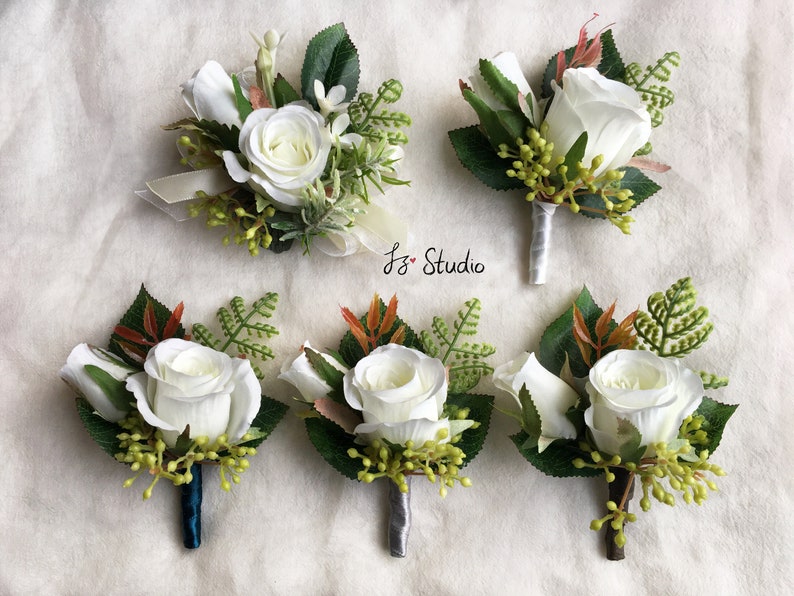
The height and width of the screenshot is (596, 794). I want to click on studio, so click(x=441, y=265).